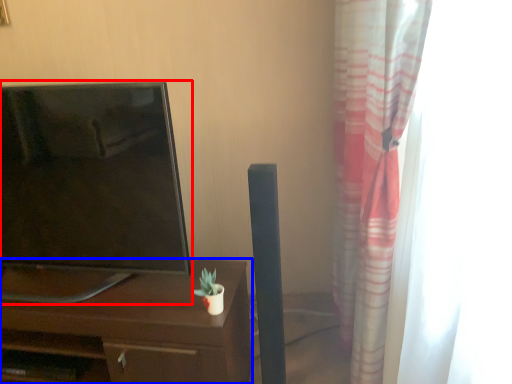
Question: Which point is further to the camera, television (highlighted by a red box) or desk (highlighted by a blue box)?

Choices:
 (A) television
 (B) desk

Answer: (B)